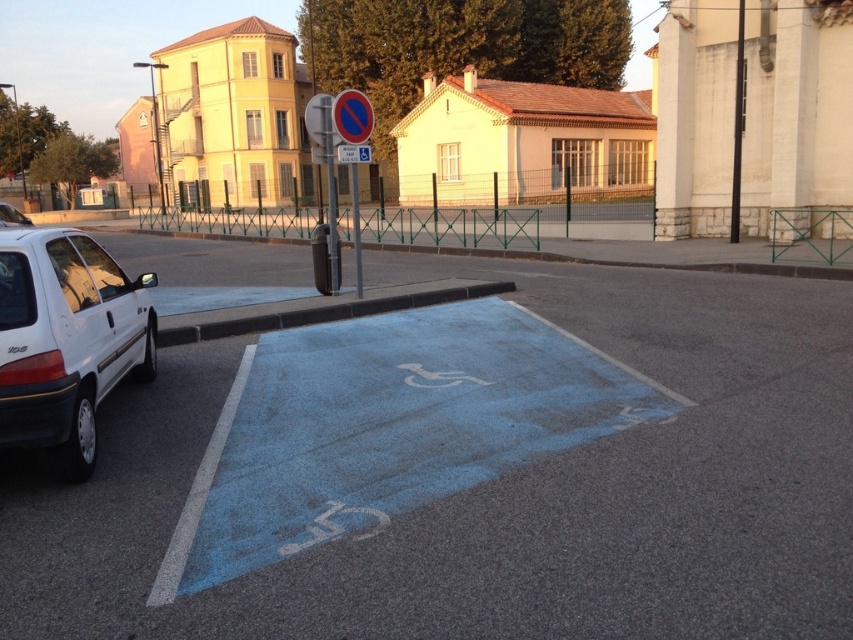
Is point (79, 419) closer to viewer compared to point (343, 157)?

Yes.

Who is positioned more to the right, white matte hatchback at left or blue painted sign at center?

blue painted sign at center

Does point (53, 250) lie behind point (339, 157)?

No, (53, 250) is in front of (339, 157).

The height and width of the screenshot is (640, 853). I want to click on white matte hatchback at left, so click(67, 340).

Which is above, blue asphalt bike lane at lower left or blue painted sign at center?

blue painted sign at center

Does blue asphalt bike lane at lower left have a smaller size compared to blue painted sign at center?

No.

Measure the distance between point (363, 486) and camera.

Point (363, 486) and camera are 16.27 feet apart from each other.

Where is `blue asphalt bike lane at lower left`? blue asphalt bike lane at lower left is located at coordinates (387, 428).

Does blue painted sign at center have a lesser height compared to white matte car at left?

Yes, blue painted sign at center is shorter than white matte car at left.

Does blue painted sign at center have a smaller size compared to white matte car at left?

Indeed, blue painted sign at center has a smaller size compared to white matte car at left.

Identify the location of blue painted sign at center. This screenshot has height=640, width=853. [x=352, y=154].